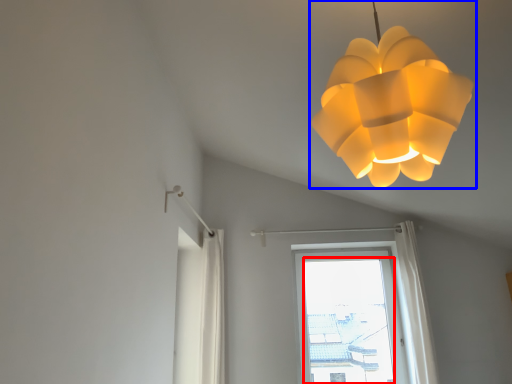
Question: Which object appears closest to the camera in this image, window screen (highlighted by a red box) or lamp (highlighted by a blue box)?

Choices:
 (A) window screen
 (B) lamp

Answer: (B)